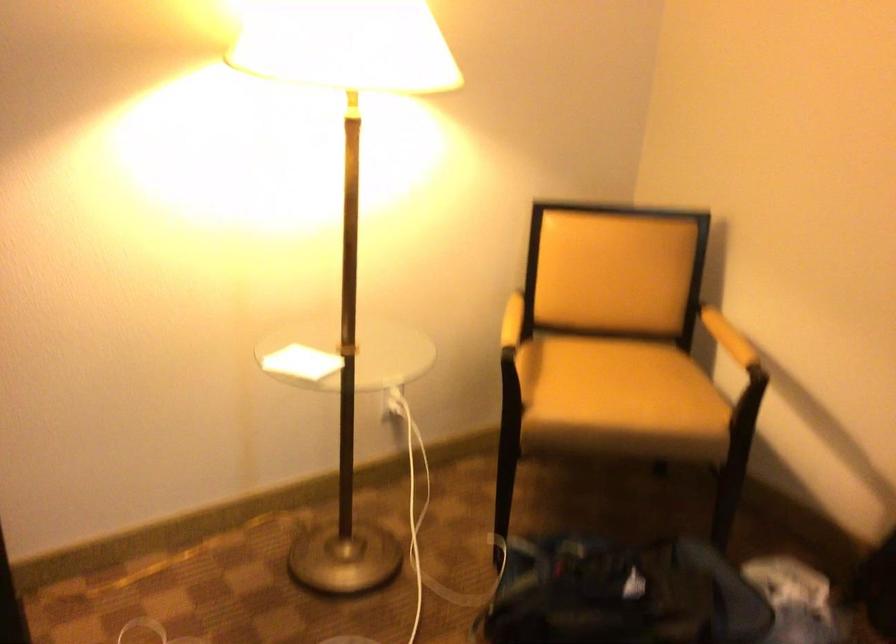
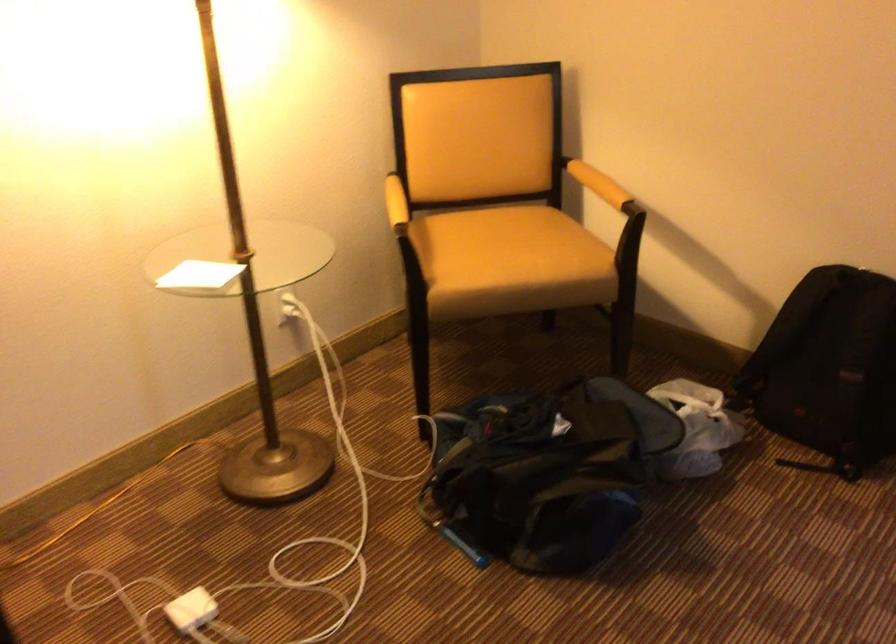
Locate, in the second image, the point that corresponds to (x=613, y=400) in the first image.

(510, 261)